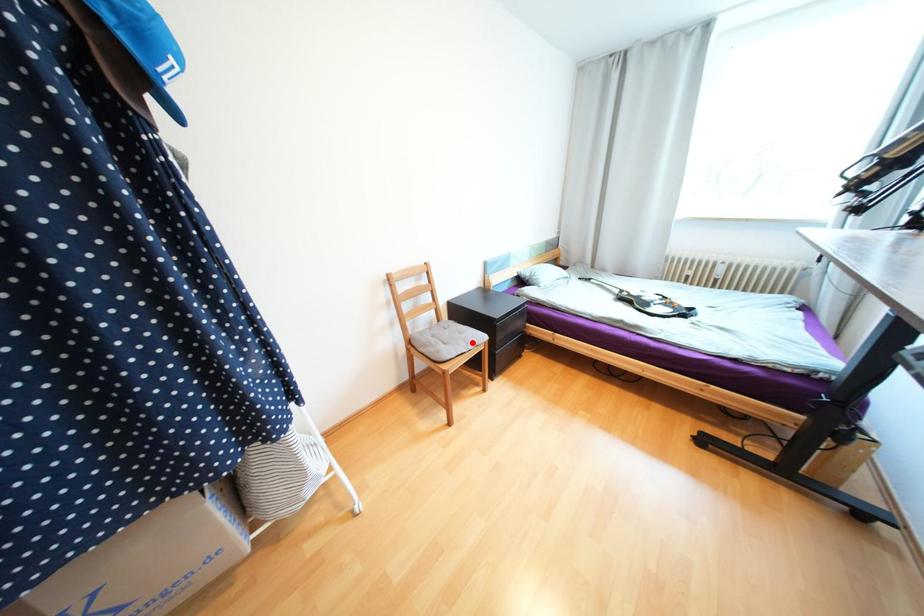
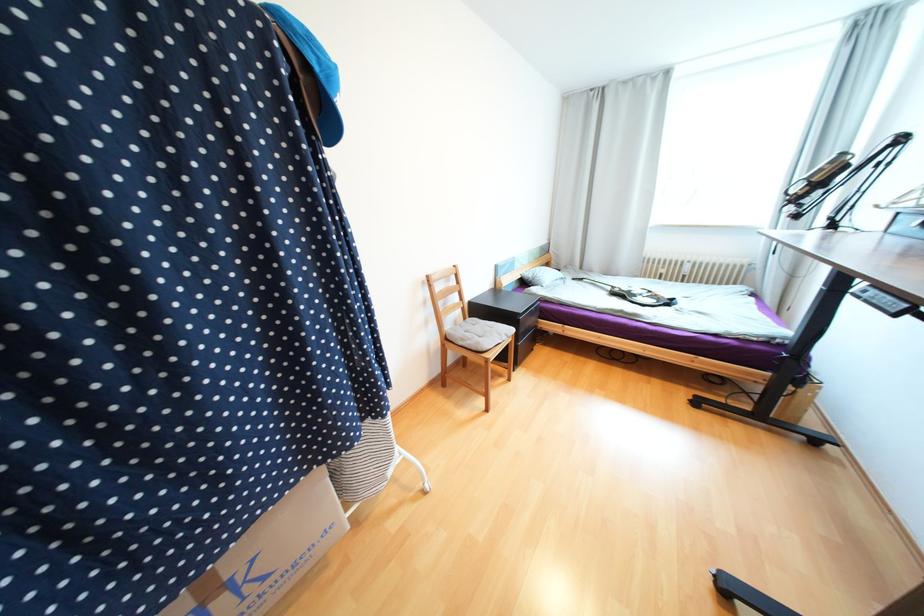
Find the pixel in the second image that matches the highlighted location in the first image.

(505, 334)